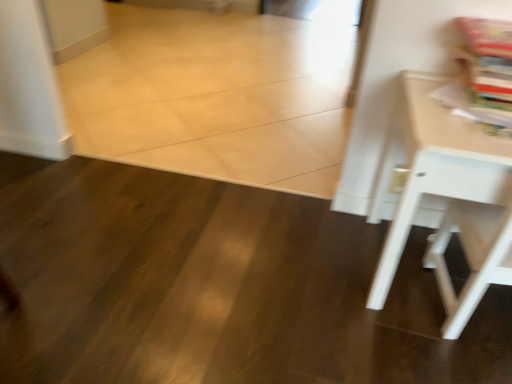
Question: Can you confirm if white matte table at right is shorter than matte paper magazine at upper right?

Choices:
 (A) yes
 (B) no

Answer: (B)

Question: Considering the relative positions of white matte table at right and matte paper magazine at upper right in the image provided, is white matte table at right behind matte paper magazine at upper right?

Choices:
 (A) yes
 (B) no

Answer: (B)

Question: Does white matte table at right have a smaller size compared to matte paper magazine at upper right?

Choices:
 (A) yes
 (B) no

Answer: (B)

Question: Is matte paper magazine at upper right inside white matte table at right?

Choices:
 (A) yes
 (B) no

Answer: (A)

Question: Could you tell me if white matte table at right is turned towards matte paper magazine at upper right?

Choices:
 (A) yes
 (B) no

Answer: (B)

Question: Does white matte table at right have a larger size compared to matte paper magazine at upper right?

Choices:
 (A) yes
 (B) no

Answer: (A)

Question: Can white matte table at right be found inside matte paper magazine at upper right?

Choices:
 (A) no
 (B) yes

Answer: (A)

Question: From the image's perspective, would you say matte paper magazine at upper right is positioned over white matte table at right?

Choices:
 (A) yes
 (B) no

Answer: (A)

Question: Does matte paper magazine at upper right come behind white matte table at right?

Choices:
 (A) yes
 (B) no

Answer: (A)

Question: Considering the relative sizes of matte paper magazine at upper right and white matte table at right in the image provided, is matte paper magazine at upper right bigger than white matte table at right?

Choices:
 (A) yes
 (B) no

Answer: (B)

Question: Is matte paper magazine at upper right shorter than white matte table at right?

Choices:
 (A) no
 (B) yes

Answer: (B)

Question: Can you confirm if matte paper magazine at upper right is taller than white matte table at right?

Choices:
 (A) no
 (B) yes

Answer: (A)

Question: Is matte paper magazine at upper right bigger or smaller than white matte table at right?

Choices:
 (A) small
 (B) big

Answer: (A)